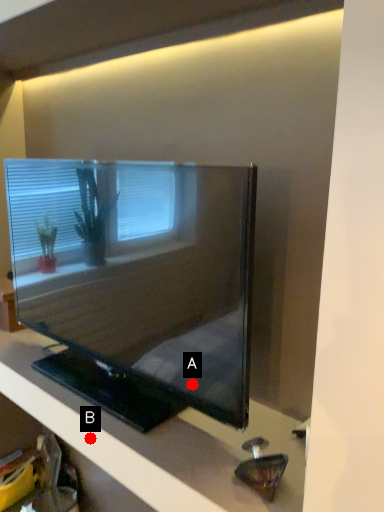
Question: Two points are circled on the image, labeled by A and B beside each circle. Which point appears farthest from the camera in this image?

Choices:
 (A) A is further
 (B) B is further

Answer: (B)